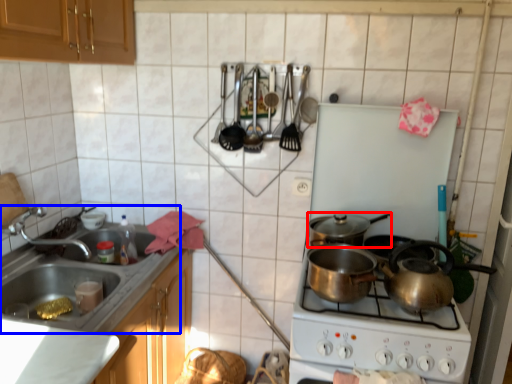
Question: Among these objects, which one is nearest to the camera, kitchen appliance (highlighted by a red box) or sink (highlighted by a blue box)?

Choices:
 (A) kitchen appliance
 (B) sink

Answer: (B)